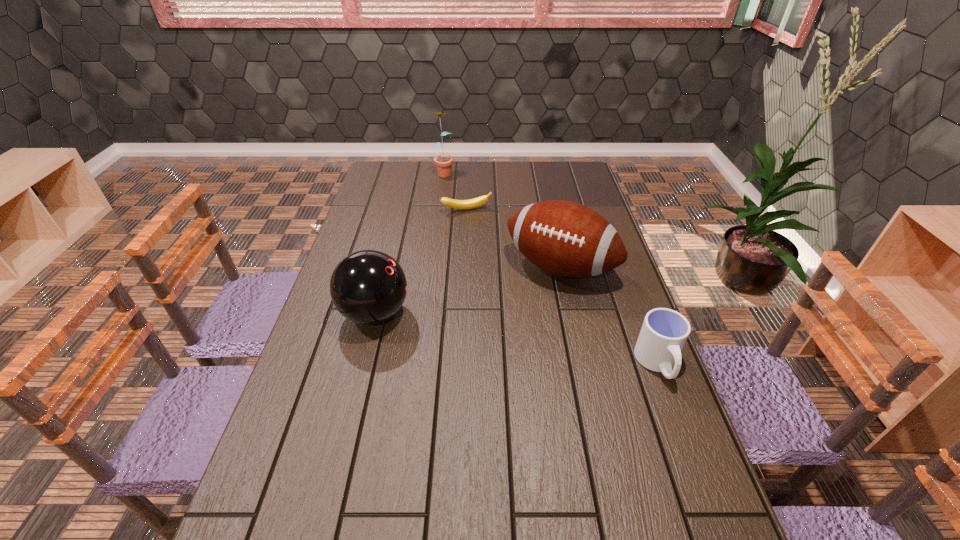
Find the location of `unoccupied position between the nearest object and the bowling ball`. unoccupied position between the nearest object and the bowling ball is located at coordinates (516, 339).

Where is `free space between the sunflower and the football`? The width and height of the screenshot is (960, 540). free space between the sunflower and the football is located at coordinates (502, 219).

At what (x,y) coordinates should I click in order to perform the action: click on free space between the football and the nearest object. Please return your answer as a coordinate pair (x, y). Looking at the image, I should click on (609, 316).

The height and width of the screenshot is (540, 960). I want to click on free space between the fourth tallest object and the shortest object, so click(563, 287).

At what (x,y) coordinates should I click in order to perform the action: click on free spot between the bowling ball and the football. Please return your answer as a coordinate pair (x, y). Looking at the image, I should click on 468,291.

You are a GUI agent. You are given a task and a screenshot of the screen. Output one action in this format:
    pyautogui.click(x=<x>, y=<y>)
    Task: Click on the vacant space in between the sunflower and the bowling ball
    This screenshot has width=960, height=540.
    Given the screenshot: What is the action you would take?
    pyautogui.click(x=409, y=242)

Find the location of a particular element. This screenshot has height=540, width=960. object identified as the second closest to the football is located at coordinates (479, 201).

This screenshot has width=960, height=540. Find the location of `object that is the closest to the farthest object`. object that is the closest to the farthest object is located at coordinates (479, 201).